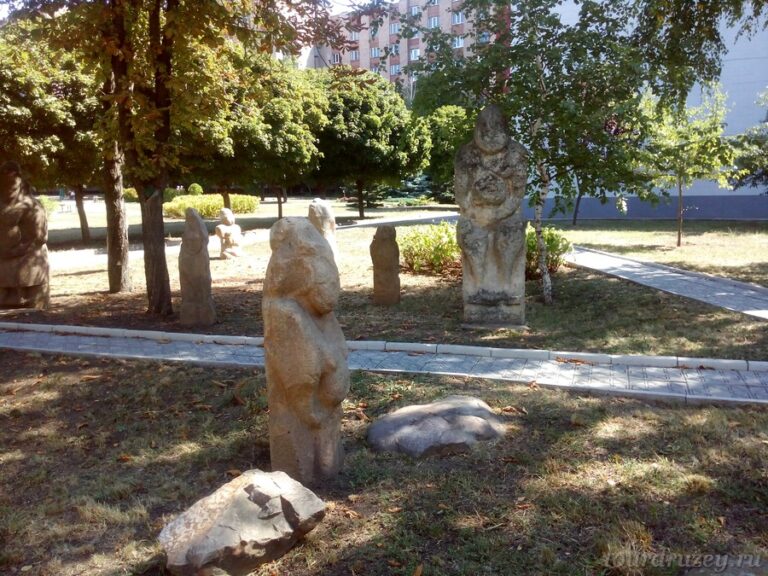
Where is `statue`? statue is located at coordinates (306, 325), (462, 262), (385, 267), (187, 269), (22, 238), (227, 236), (322, 213).